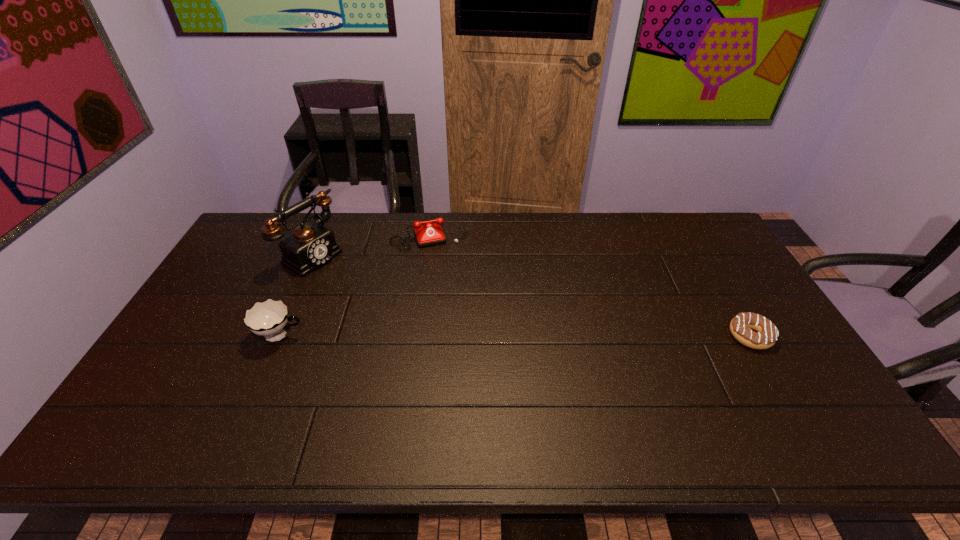
Identify the location of free spot at the near left corner of the desktop. The image size is (960, 540). (196, 381).

Find the location of a particular element. free point between the cup and the shortest object is located at coordinates (516, 336).

The image size is (960, 540). I want to click on free point between the rightmost object and the taller telephone, so click(532, 295).

This screenshot has width=960, height=540. Identify the location of free area in between the shortest object and the shorter telephone. click(589, 285).

Locate an element on the screen. Image resolution: width=960 pixels, height=540 pixels. empty location between the taller telephone and the shortest object is located at coordinates (532, 295).

Find the location of a particular element. The image size is (960, 540). vacant area between the rightmost object and the cup is located at coordinates (516, 336).

Image resolution: width=960 pixels, height=540 pixels. I want to click on free space between the right telephone and the third shortest object, so click(x=355, y=285).

This screenshot has height=540, width=960. I want to click on free space between the second object from right to left and the second tallest object, so click(355, 285).

I want to click on vacant area between the cup and the taller telephone, so click(x=298, y=295).

The image size is (960, 540). Find the location of `free spot between the taller telephone and the second shortest object`. free spot between the taller telephone and the second shortest object is located at coordinates (372, 244).